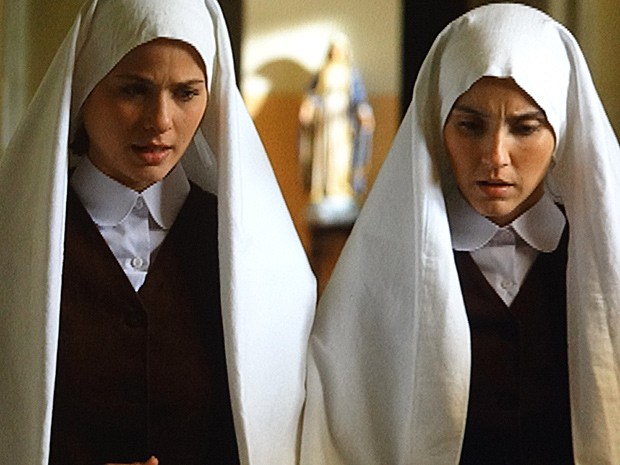
Where is `sunlight shining on wall`? sunlight shining on wall is located at coordinates (x=302, y=45).